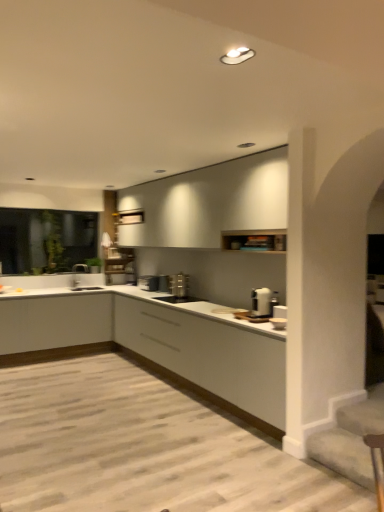
Question: Is white matte cabinet at upper center, the first cabinetry when ordered from top to bottom, in front of or behind white matte cabinet at center, the 1th cabinetry when ordered from bottom to top, in the image?

Choices:
 (A) behind
 (B) front

Answer: (A)

Question: Considering the positions of white matte cabinet at upper center, the 3th cabinetry in the bottom-to-top sequence, and white matte cabinet at center, positioned as the third cabinetry in top-to-bottom order, in the image, is white matte cabinet at upper center, the 3th cabinetry in the bottom-to-top sequence, wider or thinner than white matte cabinet at center, positioned as the third cabinetry in top-to-bottom order,?

Choices:
 (A) wide
 (B) thin

Answer: (B)

Question: Which is farther from the silver metallic tap at center?

Choices:
 (A) transparent glass door at left
 (B) satin silver toaster at center, acting as the 2th appliance starting from the back
 (C) white matte cabinet at center, the 1th cabinetry when ordered from bottom to top
 (D) white matte cabinet at lower left, the 2th cabinetry from the bottom
 (E) white matte cabinet at upper center, the 3th cabinetry in the bottom-to-top sequence

Answer: (C)

Question: Which is nearer to the silver metallic tap at center?

Choices:
 (A) transparent glass door at left
 (B) white matte cabinet at center, positioned as the third cabinetry in top-to-bottom order
 (C) satin silver toaster at center, acting as the 2th appliance starting from the back
 (D) satin silver toaster at center, the fourth appliance viewed from the front
 (E) white glossy toaster at center, which is the fourth appliance from left to right

Answer: (A)